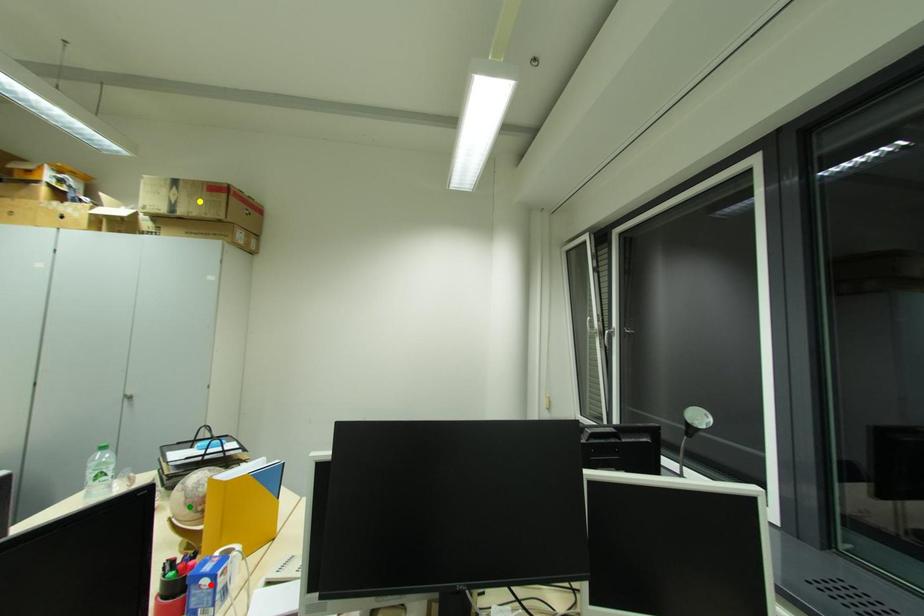
Order these from nearest to farthest:
A) yellow point
B) green point
C) red point

red point < green point < yellow point